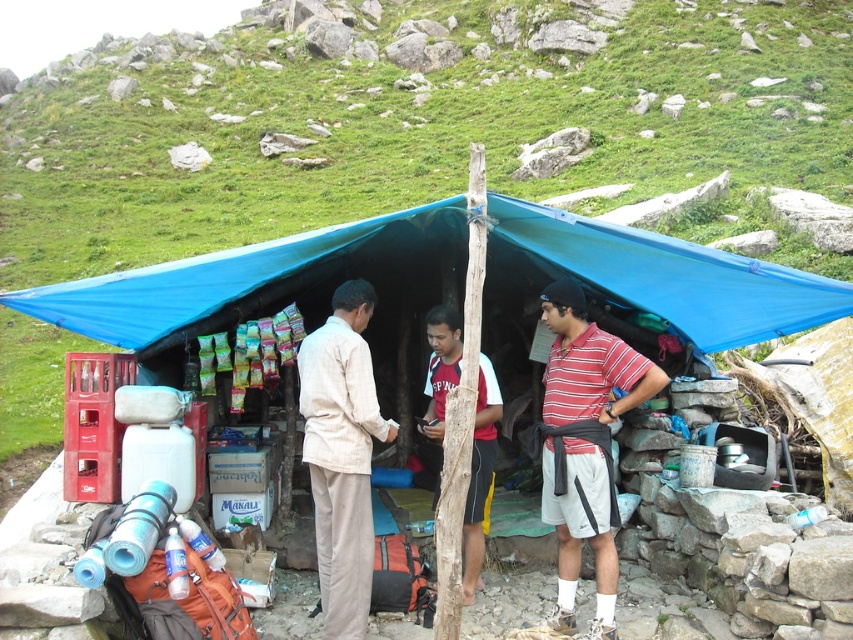
Can you confirm if striped cotton polo shirt at center is bigger than light beige cotton shirt at center?

Indeed, striped cotton polo shirt at center has a larger size compared to light beige cotton shirt at center.

Does striped cotton polo shirt at center have a lesser width compared to light beige cotton shirt at center?

Incorrect, striped cotton polo shirt at center's width is not less than light beige cotton shirt at center's.

Find the location of a particular element. Image resolution: width=853 pixels, height=640 pixels. striped cotton polo shirt at center is located at coordinates (584, 444).

Can you confirm if light beige cotton shirt at center is taller than red and white jersey at center?

Correct, light beige cotton shirt at center is much taller as red and white jersey at center.

Consider the image. Between light beige cotton shirt at center and red and white jersey at center, which one appears on the left side from the viewer's perspective?

light beige cotton shirt at center

Is point (329, 545) more distant than point (473, 493)?

No, (329, 545) is closer to viewer.

At what (x,y) coordinates should I click in order to perform the action: click on light beige cotton shirt at center. Please return your answer as a coordinate pair (x, y). Image resolution: width=853 pixels, height=640 pixels. Looking at the image, I should click on (341, 454).

This screenshot has width=853, height=640. Describe the element at coordinates (663, 273) in the screenshot. I see `blue tarp at center` at that location.

Which is above, blue tarp at center or striped cotton polo shirt at center?

blue tarp at center

This screenshot has height=640, width=853. What do you see at coordinates (663, 273) in the screenshot? I see `blue tarp at center` at bounding box center [663, 273].

Find the location of a particular element. blue tarp at center is located at coordinates (663, 273).